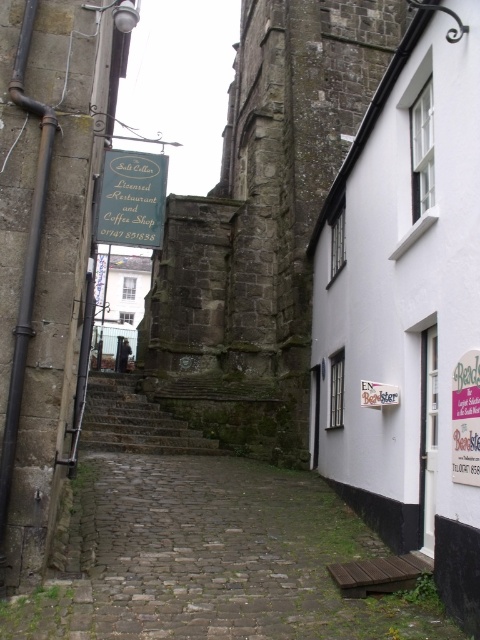
Between stone textured tower at center and green painted wood signboard at center, which one appears on the right side from the viewer's perspective?

From the viewer's perspective, stone textured tower at center appears more on the right side.

Does stone textured tower at center lie in front of green painted wood signboard at center?

That is False.

Is point (312, 128) farther from viewer compared to point (106, 212)?

Yes.

Locate an element on the screen. The height and width of the screenshot is (640, 480). stone textured tower at center is located at coordinates (262, 225).

Can you confirm if rusty stone stairs at center is positioned to the left of green painted wood signboard at center?

Yes, rusty stone stairs at center is to the left of green painted wood signboard at center.

Who is taller, rusty stone stairs at center or green painted wood signboard at center?

Standing taller between the two is green painted wood signboard at center.

Is point (179, 426) positioned in front of point (123, 172)?

No.

You are a GUI agent. You are given a task and a screenshot of the screen. Output one action in this format:
    pyautogui.click(x=<x>, y=<y>)
    Task: Click on the rusty stone stairs at center
    This screenshot has height=640, width=480.
    Given the screenshot: What is the action you would take?
    pyautogui.click(x=134, y=420)

Which of these two, stone textured tower at center or rusty stone stairs at center, stands shorter?

With less height is rusty stone stairs at center.

Who is more distant from viewer, (205, 349) or (92, 433)?

Point (205, 349)

Between point (297, 221) and point (92, 433), which one is positioned behind?

The point (297, 221) is more distant.

At what (x,y) coordinates should I click in order to perform the action: click on stone textured tower at center. Please return your answer as a coordinate pair (x, y). The width and height of the screenshot is (480, 640). Looking at the image, I should click on (262, 225).